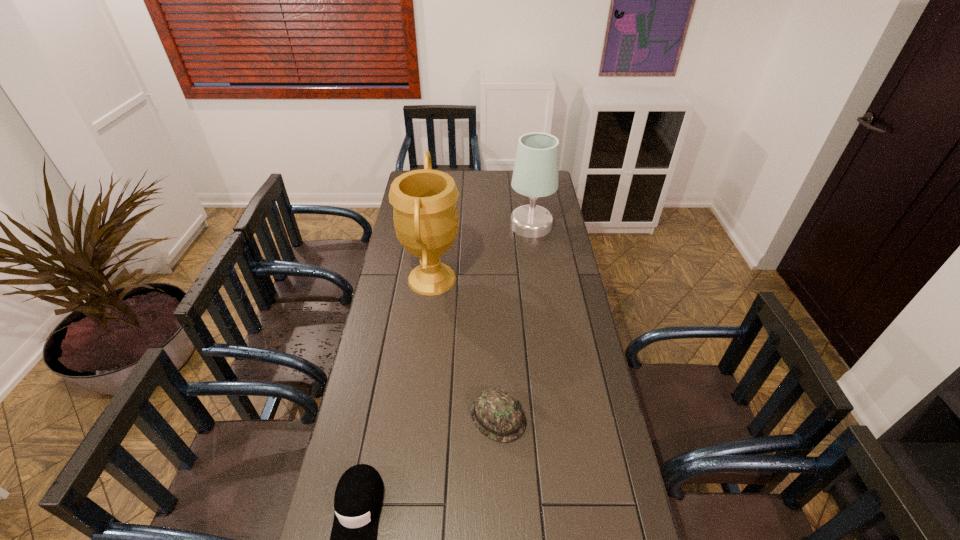
In the image, there is a desktop. Identify the location of free region at the right edge. The height and width of the screenshot is (540, 960). (548, 258).

This screenshot has width=960, height=540. In order to click on free space between the third farthest object and the lampshade in this screenshot , I will do `click(515, 321)`.

This screenshot has height=540, width=960. I want to click on free space between the farthest object and the farther cap, so click(515, 321).

The width and height of the screenshot is (960, 540). I want to click on empty location between the second nearest object and the second farthest object, so click(x=466, y=348).

Find the location of a particular element. The image size is (960, 540). empty space between the lampshade and the second farthest object is located at coordinates (482, 252).

The width and height of the screenshot is (960, 540). I want to click on object that is the second nearest to the left cap, so click(x=426, y=220).

Identify which object is located as the nearest to the nearest object. Please provide its 2D coordinates. Your answer should be formatted as a tuple, i.e. [(x, y)], where the tuple contains the x and y coordinates of a point satisfying the conditions above.

[(495, 412)]

Select which cap appears as the closest to the farthest object. Please provide its 2D coordinates. Your answer should be formatted as a tuple, i.e. [(x, y)], where the tuple contains the x and y coordinates of a point satisfying the conditions above.

[(495, 412)]

This screenshot has height=540, width=960. I want to click on cap that stands as the closest to the lampshade, so [x=495, y=412].

The width and height of the screenshot is (960, 540). Find the location of `vacant area that satisfies the following two spatial constraints: 1. on the engravings side of the trophy; 2. on the right side of the farther cap`. vacant area that satisfies the following two spatial constraints: 1. on the engravings side of the trophy; 2. on the right side of the farther cap is located at coordinates (416, 417).